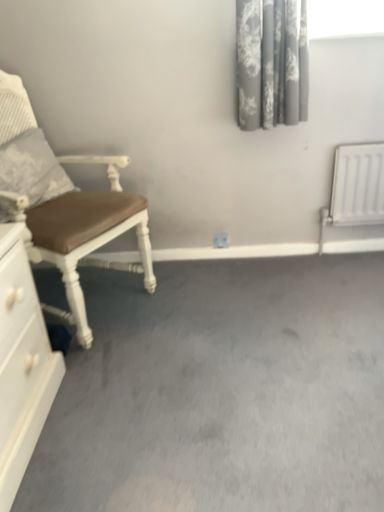
The image size is (384, 512). What are the coordinates of `vacant space to the right of brown leather chair at left` in the screenshot? It's located at (191, 306).